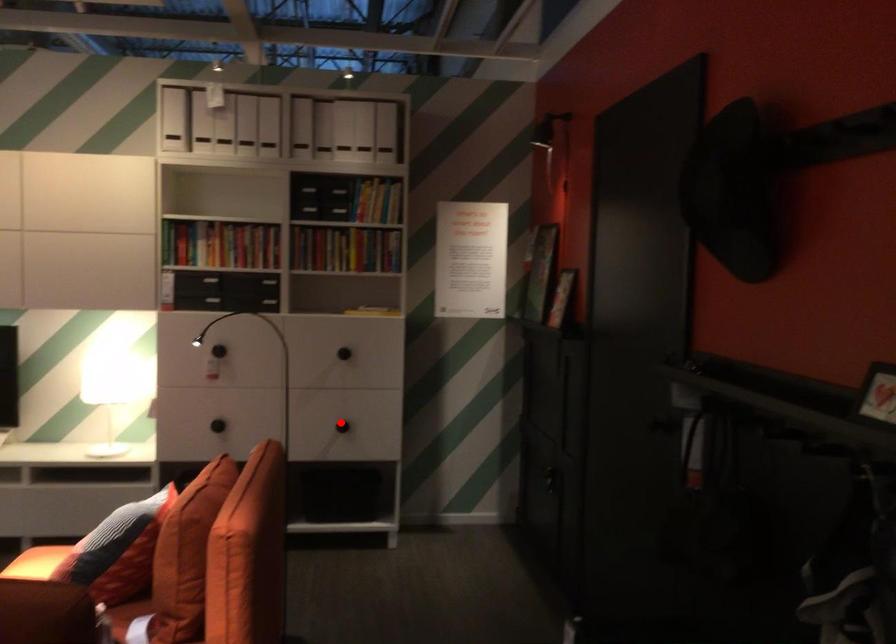
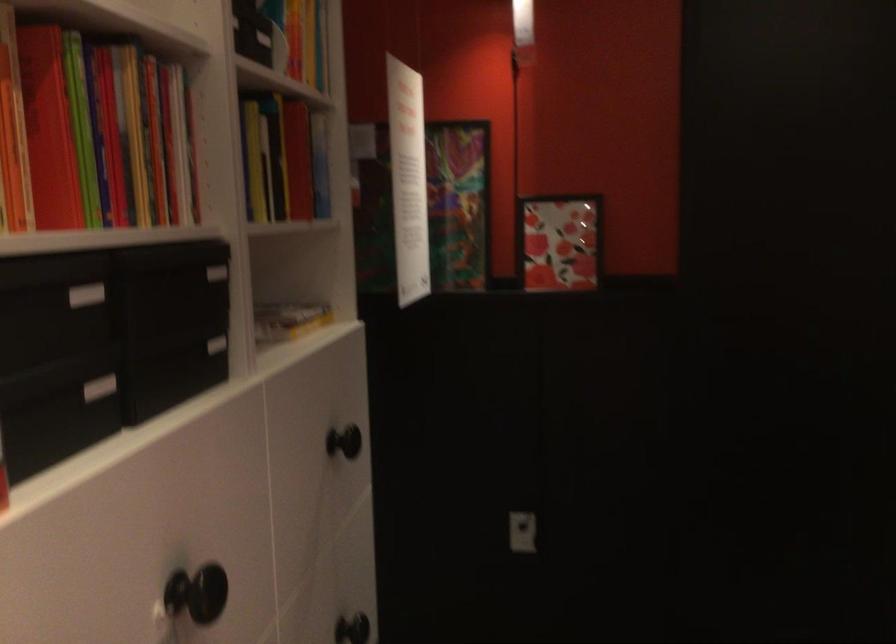
Locate, in the second image, the point that corresponds to the highlighted location in the first image.

(351, 629)